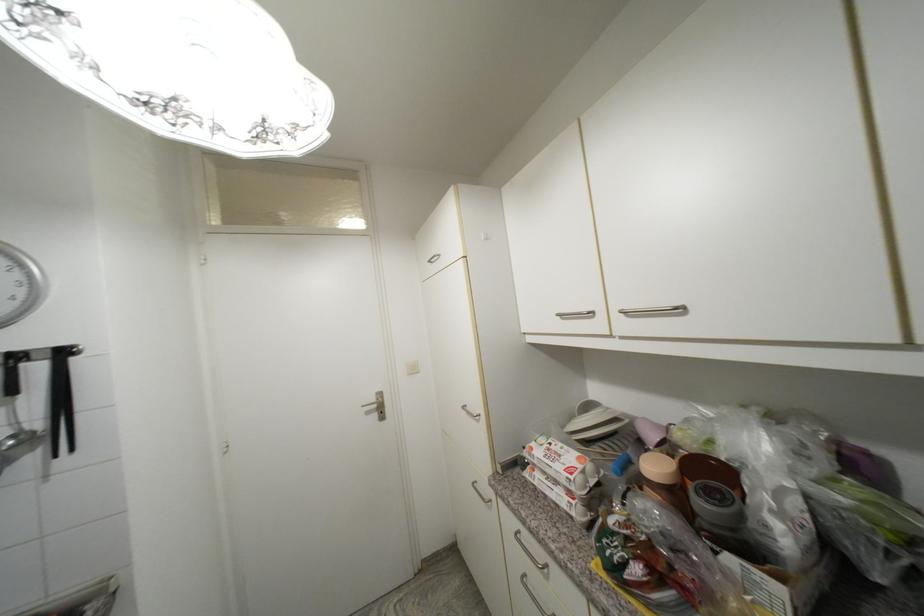
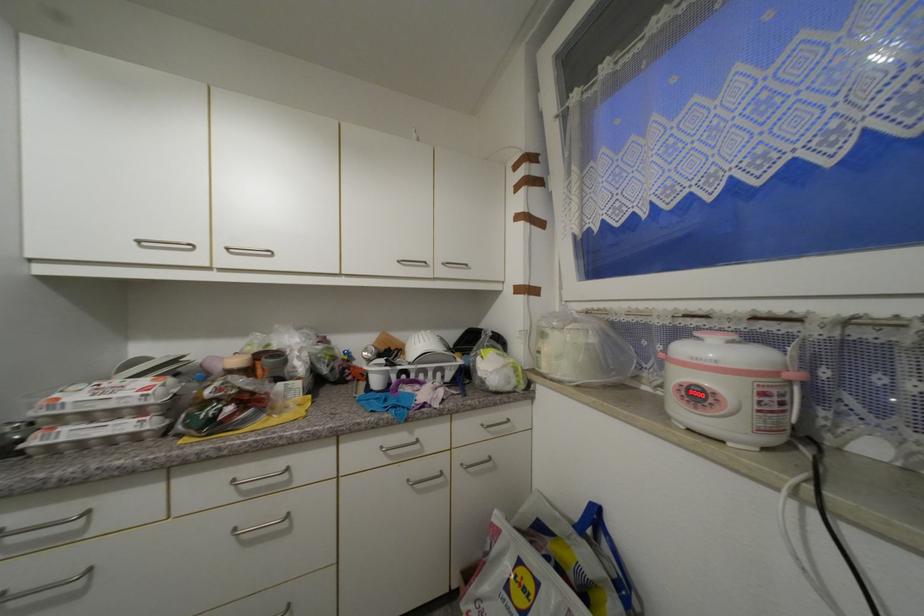
Where in the second image is the point corresponding to the point at 530,577 from the first image?

(6, 597)